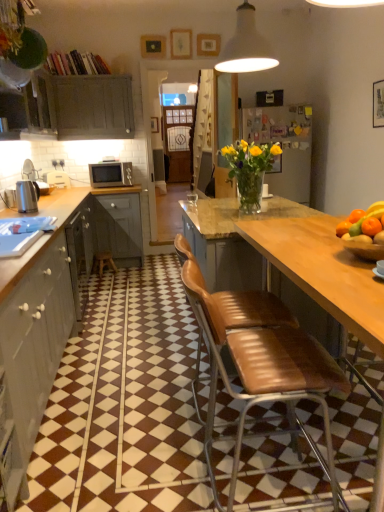
Image resolution: width=384 pixels, height=512 pixels. I want to click on unoccupied region to the right of polished stainless steel kettle at left, so click(57, 208).